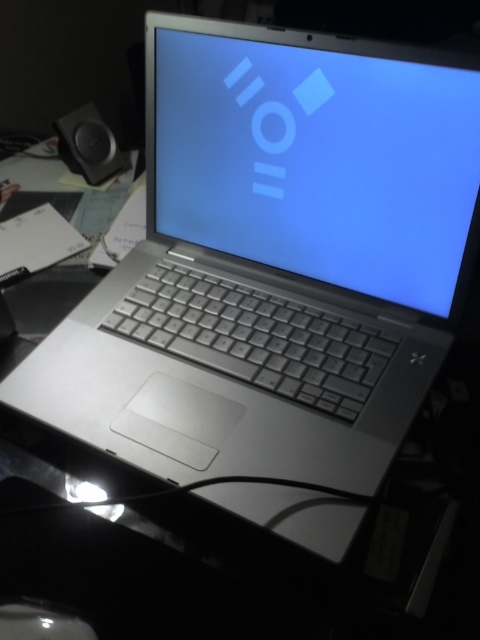
Question: In this image, where is matte plastic screen at center located relative to black matte speaker at upper left?

Choices:
 (A) left
 (B) right

Answer: (B)

Question: Which point is farther from the camera taking this photo?

Choices:
 (A) (457, 241)
 (B) (111, 134)

Answer: (B)

Question: Is the position of matte plastic screen at center less distant than that of black matte speaker at upper left?

Choices:
 (A) no
 (B) yes

Answer: (B)

Question: Is the position of matte plastic screen at center more distant than that of black matte speaker at upper left?

Choices:
 (A) yes
 (B) no

Answer: (B)